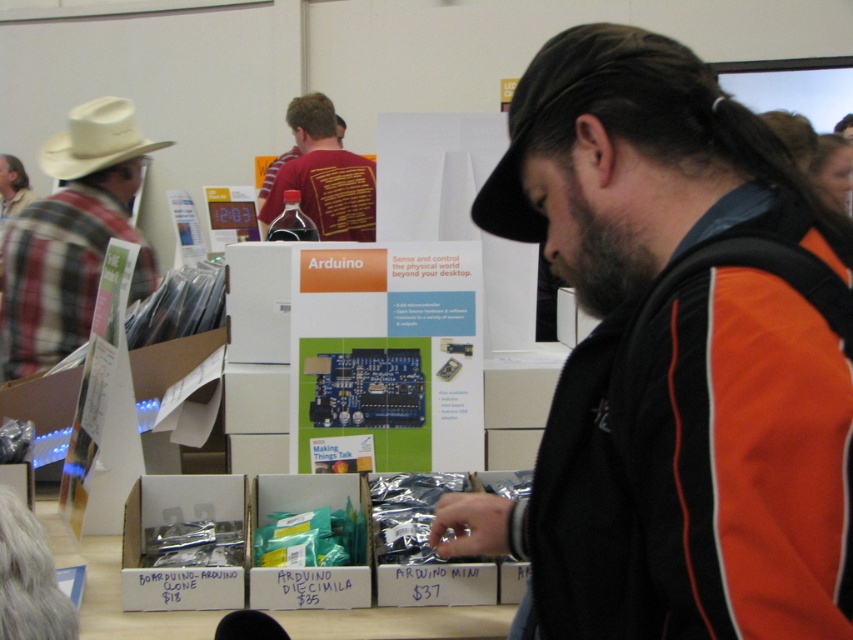
Which is more to the left, metallic silver arduino clone at lower left or white felt cowboy hat at left?

From the viewer's perspective, white felt cowboy hat at left appears more on the left side.

Is metallic silver arduino clone at lower left positioned before white felt cowboy hat at left?

Yes, metallic silver arduino clone at lower left is in front of white felt cowboy hat at left.

Identify the location of metallic silver arduino clone at lower left. (178, 520).

Does point (138, 145) come in front of point (144, 600)?

No, (138, 145) is behind (144, 600).

Consider the image. Can you confirm if white leather cowboy hat at left is shorter than metallic silver arduino clone at lower left?

No.

Is point (53, 198) closer to viewer compared to point (206, 484)?

No.

Image resolution: width=853 pixels, height=640 pixels. Identify the location of white leather cowboy hat at left. (73, 236).

Does point (287, 172) lie behind point (107, 161)?

Yes.

Is point (285, 179) closer to camera compared to point (86, 113)?

No, (285, 179) is further to viewer.

The width and height of the screenshot is (853, 640). In order to click on matte red shirt at upper center in this screenshot , I will do `click(323, 176)`.